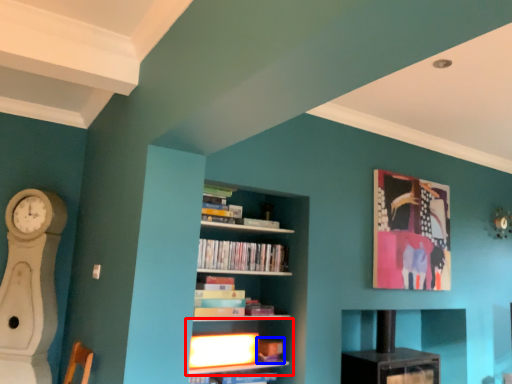
Question: Which of the following is the farthest to the observer, shelf (highlighted by a red box) or book (highlighted by a blue box)?

Choices:
 (A) shelf
 (B) book

Answer: (B)